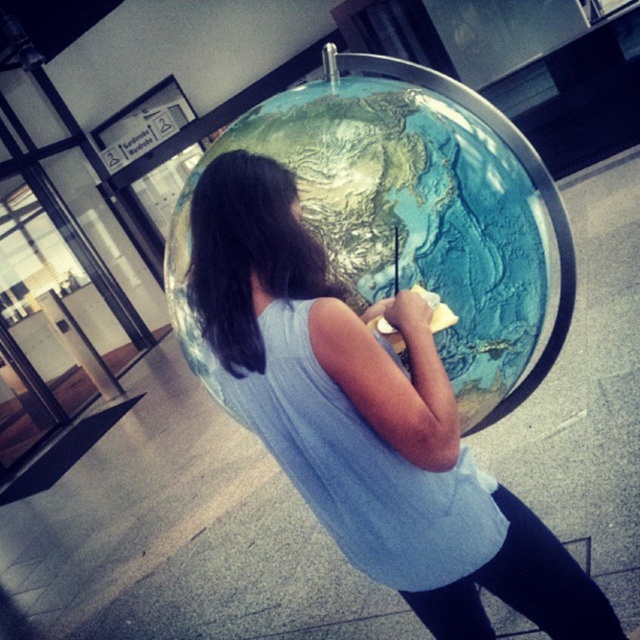
What are the coordinates of the matte blue shirt at center?

The matte blue shirt at center is located at coordinates point (x=365, y=419).

You are a photographer standing in the room where the matte blue shirt at center and the matte blue globe at center are both visible. You want to take a photo that captures both objects in the frame without any part of them being cut off. Which object should you focus on to ensure both are fully visible?

The matte blue shirt at center is shorter than the matte blue globe at center. To ensure both are fully visible in the photo, focus on the taller object, the matte blue globe at center, as it will require a wider angle to include its full height while still capturing the shorter matte blue shirt at center.

Based on the photo, you are a photographer trying to capture a closeup of the matte blue globe at center. You notice the matte blue shirt at center is blocking part of the globe. Based on their sizes, can you estimate if moving the shirt slightly to the side would allow you to see the entire globe without obstruction?

The matte blue shirt at center is narrower than the matte blue globe at center, so moving it to the side should allow the entire globe to be visible without obstruction.